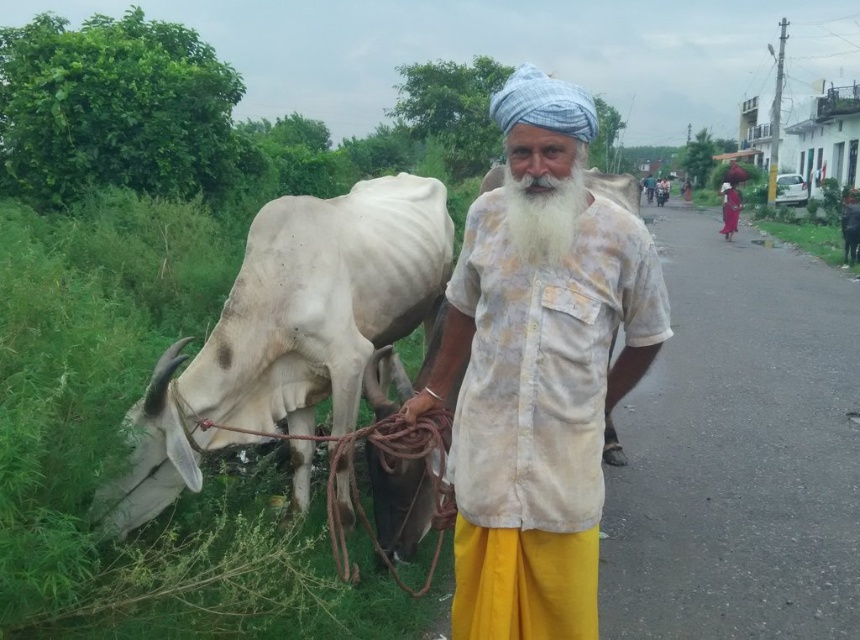
Question: Is white cotton shirt at center to the left of white matte cow at left from the viewer's perspective?

Choices:
 (A) no
 (B) yes

Answer: (A)

Question: Is white cotton shirt at center bigger than white matte cow at left?

Choices:
 (A) yes
 (B) no

Answer: (B)

Question: Which point is closer to the camera taking this photo?

Choices:
 (A) (398, 227)
 (B) (520, 435)
 (C) (521, 227)
 (D) (808, 225)

Answer: (C)

Question: Which point is closer to the camera?

Choices:
 (A) white fluffy beard at center
 (B) white cotton shirt at center
 (C) white matte cow at left
 (D) green leafy grass at lower right

Answer: (B)

Question: Is white cotton shirt at center wider than white fluffy beard at center?

Choices:
 (A) no
 (B) yes

Answer: (B)

Question: Among these objects, which one is farthest from the camera?

Choices:
 (A) white fluffy beard at center
 (B) white cotton shirt at center
 (C) white matte cow at left
 (D) green leafy grass at lower right

Answer: (D)